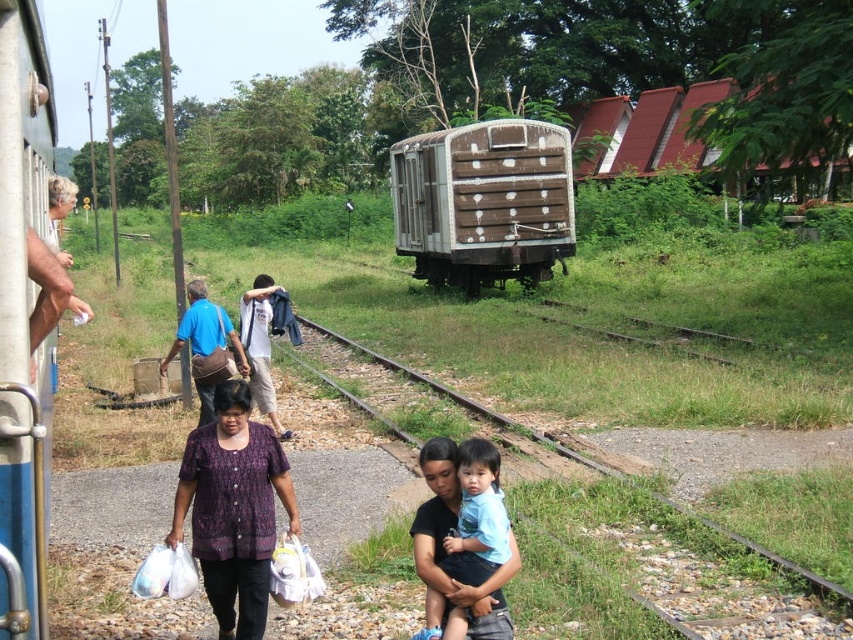
Question: Is brown wooden train at center below gravel railroad track at center?

Choices:
 (A) yes
 (B) no

Answer: (B)

Question: Estimate the real-world distances between objects in this image. Which object is farther from the white cotton shirt at center?

Choices:
 (A) gravel railroad track at center
 (B) brown wooden train at center

Answer: (B)

Question: Estimate the real-world distances between objects in this image. Which object is farther from the gravel railroad track at center?

Choices:
 (A) blue fabric bag at center
 (B) white cotton shirt at center

Answer: (A)

Question: Observing the image, what is the correct spatial positioning of blue painted metal train at left in reference to blue fabric bag at center?

Choices:
 (A) below
 (B) above

Answer: (B)

Question: Does blue painted metal train at left have a lesser width compared to gravel railroad track at center?

Choices:
 (A) yes
 (B) no

Answer: (A)

Question: Which point is farther to the camera?

Choices:
 (A) blue painted metal train at left
 (B) gravel railroad track at center
 (C) blue fabric bag at center
 (D) brown wooden train at center

Answer: (D)